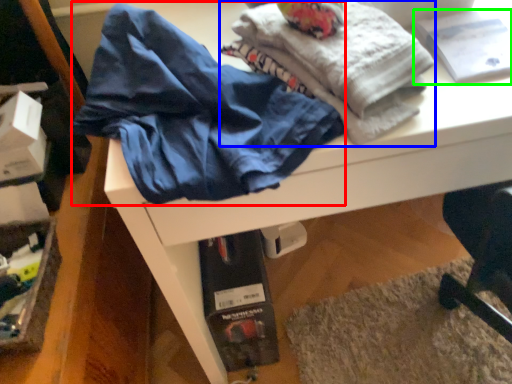
Question: Considering the real-world distances, which object is closest to clothing (highlighted by a red box)? fabric (highlighted by a blue box) or book (highlighted by a green box).

Choices:
 (A) fabric
 (B) book

Answer: (A)